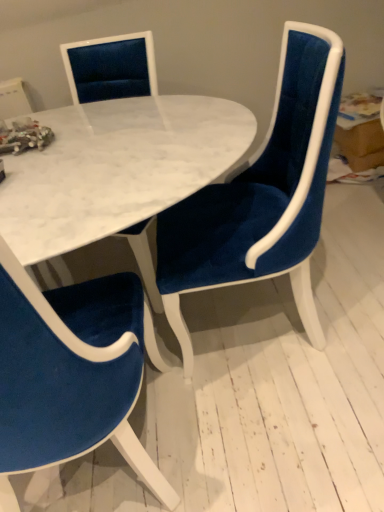
Identify the location of free space in front of velvet blue chair at center, the 1th chair viewed from the right. This screenshot has height=512, width=384. (304, 433).